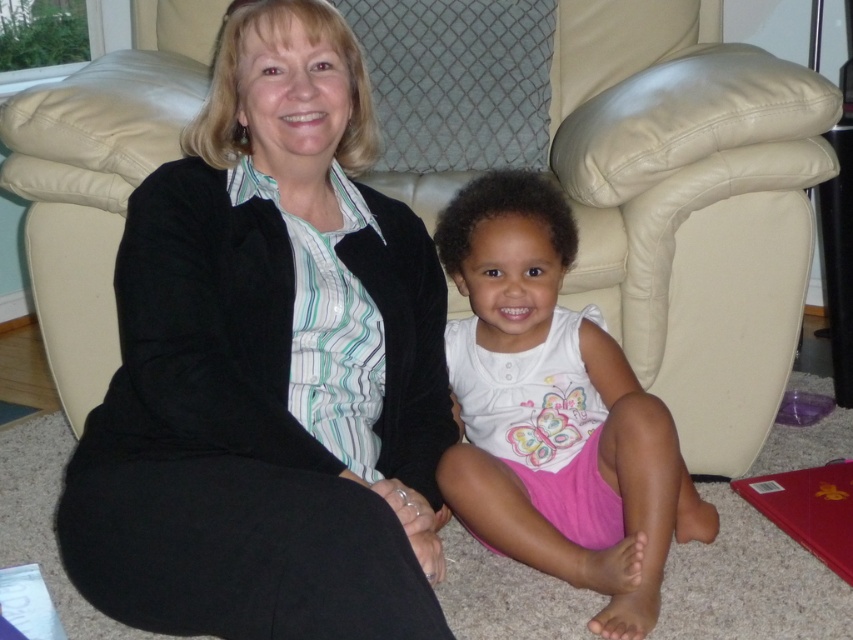
Question: Which point is closer to the camera?

Choices:
 (A) beige leather armchair at center
 (B) white cotton shirt at center

Answer: (B)

Question: Does velvet black jacket at center appear over white cotton shirt at center?

Choices:
 (A) no
 (B) yes

Answer: (B)

Question: Considering the real-world distances, which object is closest to the white cotton shirt at center?

Choices:
 (A) velvet black jacket at center
 (B) beige leather armchair at center

Answer: (B)

Question: Can you confirm if velvet black jacket at center is positioned to the right of beige leather armchair at center?

Choices:
 (A) yes
 (B) no

Answer: (B)

Question: Does beige leather armchair at center have a lesser width compared to white cotton shirt at center?

Choices:
 (A) no
 (B) yes

Answer: (B)

Question: Which object is farther from the camera taking this photo?

Choices:
 (A) velvet black jacket at center
 (B) beige leather armchair at center

Answer: (B)